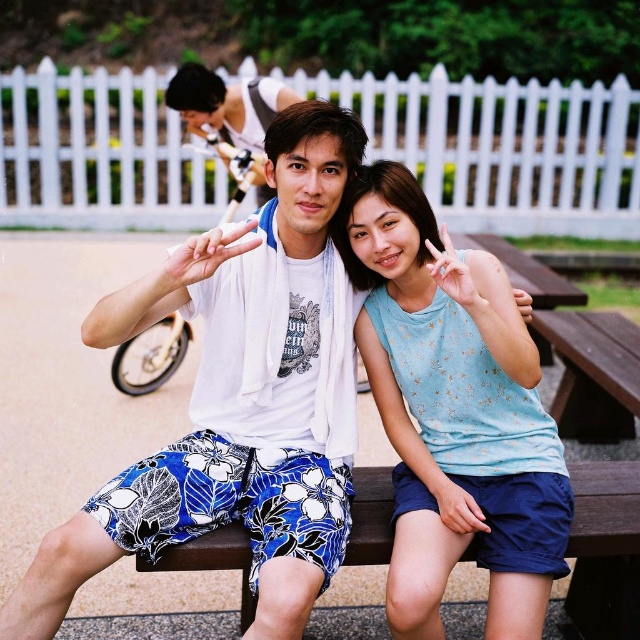
Does light blue fabric tank top at center have a lesser width compared to brown wooden bench at center?

In fact, light blue fabric tank top at center might be wider than brown wooden bench at center.

Between light blue fabric tank top at center and brown wooden bench at center, which one has more height?

light blue fabric tank top at center is taller.

This screenshot has height=640, width=640. What do you see at coordinates (452, 412) in the screenshot?
I see `light blue fabric tank top at center` at bounding box center [452, 412].

Where is `light blue fabric tank top at center`? The width and height of the screenshot is (640, 640). light blue fabric tank top at center is located at coordinates (452, 412).

Is white cotton shirt at center to the left of light blue fabric tank top at center from the viewer's perspective?

Indeed, white cotton shirt at center is positioned on the left side of light blue fabric tank top at center.

Between point (212, 406) and point (444, 548), which one is positioned in front?

Point (444, 548)

Describe the element at coordinates (234, 401) in the screenshot. I see `white cotton shirt at center` at that location.

The image size is (640, 640). Find the location of `white cotton shirt at center`. white cotton shirt at center is located at coordinates (234, 401).

Is point (369, 298) positioned after point (225, 138)?

That is False.

Is light blue fabric tank top at center to the right of matte white shirt at center from the viewer's perspective?

Yes, light blue fabric tank top at center is to the right of matte white shirt at center.

Where is `light blue fabric tank top at center`? This screenshot has width=640, height=640. light blue fabric tank top at center is located at coordinates (452, 412).

Locate an element on the screen. light blue fabric tank top at center is located at coordinates (452, 412).